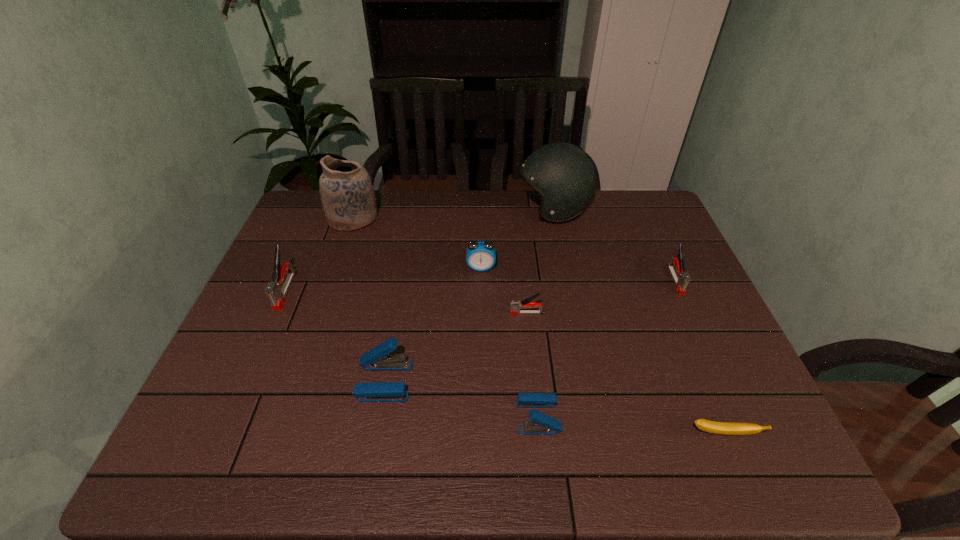
Where is `football helmet`? football helmet is located at coordinates (563, 175).

At what (x,y) coordinates should I click in order to perform the action: click on the eighth object from right to left. Please return your answer as a coordinate pair (x, y). Looking at the image, I should click on (347, 193).

I want to click on the biggest gray stapler, so click(x=276, y=293).

I want to click on the leftmost gray stapler, so click(x=276, y=293).

Identify the location of the rightmost gray stapler. (681, 278).

Find the location of a particular element. The width and height of the screenshot is (960, 540). the second smallest gray stapler is located at coordinates (681, 278).

At what (x,y) coordinates should I click in order to perform the action: click on alarm clock. Please return your answer as a coordinate pair (x, y). Looking at the image, I should click on (480, 256).

The image size is (960, 540). Identify the location of the seventh object from right to left. (377, 359).

This screenshot has height=540, width=960. In order to click on the bigger blue stapler in this screenshot , I will do `click(377, 359)`.

Find the location of a particular element. the sixth farthest object is located at coordinates (516, 305).